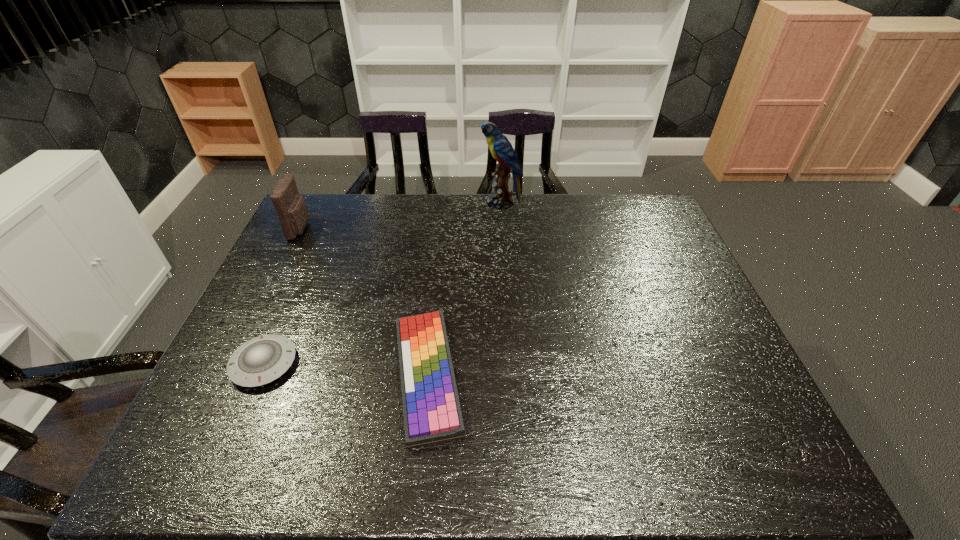
In the image, there is a desktop. Identify the location of blank space at the left edge. (324, 258).

In the image, there is a desktop. Where is `vacant space at the far left corner`? vacant space at the far left corner is located at coordinates (336, 199).

Find the location of a particular element. The width and height of the screenshot is (960, 540). vacant region at the far right corner of the desktop is located at coordinates (633, 232).

Where is `free space between the rightmost object and the saucer`? Image resolution: width=960 pixels, height=540 pixels. free space between the rightmost object and the saucer is located at coordinates (382, 284).

At what (x,y) coordinates should I click in order to perform the action: click on empty space between the saucer and the pouch. Please return your answer as a coordinate pair (x, y). Looking at the image, I should click on (282, 296).

In order to click on unoccupied position between the computer keyboard and the tallest object in this screenshot , I will do `click(464, 289)`.

The width and height of the screenshot is (960, 540). I want to click on vacant area that lies between the tallest object and the second farthest object, so click(400, 215).

The height and width of the screenshot is (540, 960). Identify the location of unoccupied area between the tallest object and the saucer. (382, 284).

Where is `free spot between the saucer and the second object from right to left`? free spot between the saucer and the second object from right to left is located at coordinates (346, 369).

I want to click on free spot between the third shortest object and the saucer, so click(x=282, y=296).